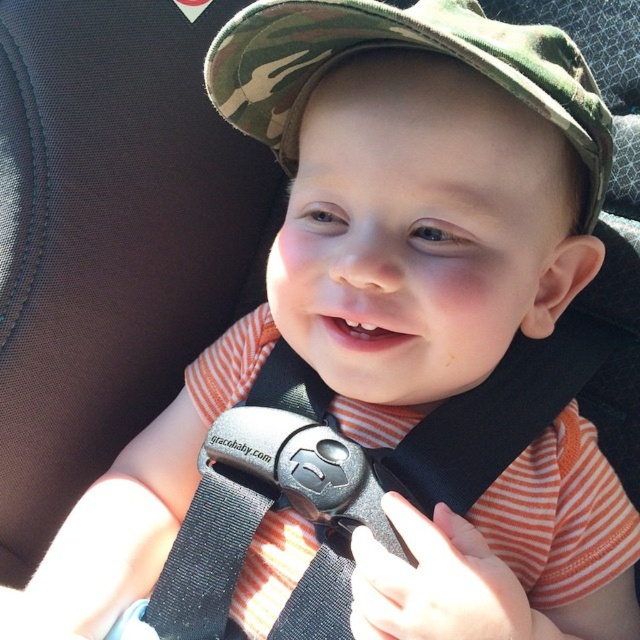
Can you confirm if black fabric seatbelt at center is wider than camo fabric hat at center?

Yes, black fabric seatbelt at center is wider than camo fabric hat at center.

Who is shorter, black fabric seatbelt at center or camo fabric hat at center?

camo fabric hat at center is shorter.

Is point (205, 628) less distant than point (372, 22)?

No, it is not.

The width and height of the screenshot is (640, 640). What are the coordinates of `black fabric seatbelt at center` in the screenshot? It's located at (492, 417).